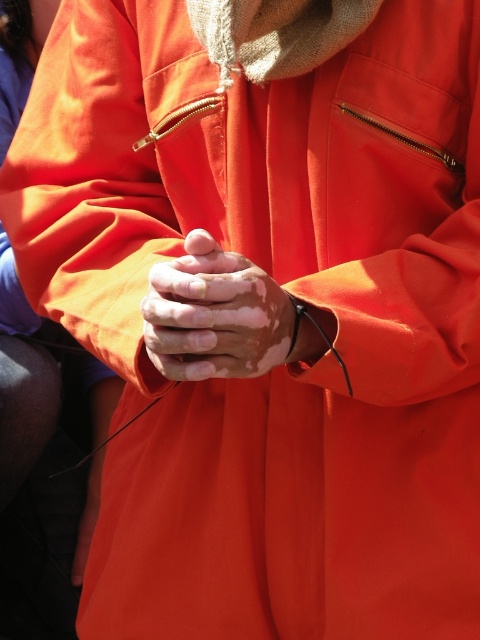
From the picture: You are a fashion designer observing the closeup of a person in a bright orange jacket. You notice the smooth skin hands at center and the smooth orange hand at center. Which hand is larger?

The smooth orange hand at center is larger than the smooth skin hands at center.

You are a photographer adjusting the lighting to ensure both the smooth skin hands at center and the smooth orange hand at center are clearly visible. Which hand should you focus on first to ensure proper exposure, considering their position?

The smooth skin hands at center is positioned on the right side of smooth orange hand at center, so you should focus on the smooth orange hand at center first since it is closer to the light source on the left side.

You are a photographer adjusting lighting for a portrait. You notice two hands at the center of the image, one labeled as smooth skin hands at center and the other as smooth orange hand at center. Which hand is visible on top in this composition?

The smooth skin hands at center is positioned over smooth orange hand at center, making it visible on top.